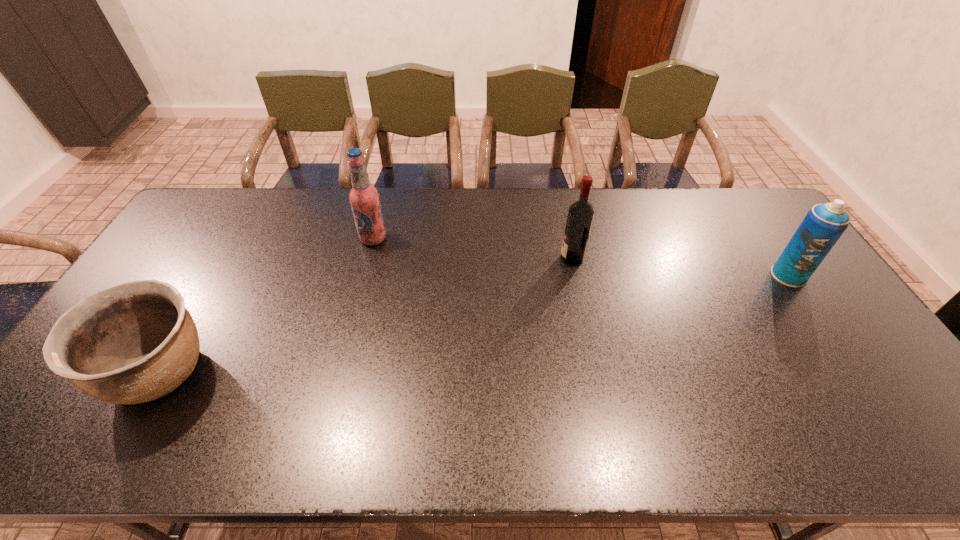
Image resolution: width=960 pixels, height=540 pixels. What are the coordinates of `the second object from left to right` in the screenshot? It's located at (364, 198).

At what (x,y) coordinates should I click in order to perform the action: click on the left alcohol. Please return your answer as a coordinate pair (x, y). Looking at the image, I should click on (364, 198).

In order to click on the nearer alcohol in this screenshot , I will do `click(580, 215)`.

You are a GUI agent. You are given a task and a screenshot of the screen. Output one action in this format:
    pyautogui.click(x=<x>, y=<y>)
    Task: Click on the third object from left to right
    Image resolution: width=960 pixels, height=540 pixels.
    Given the screenshot: What is the action you would take?
    pyautogui.click(x=580, y=215)

Where is `the rightmost object`? the rightmost object is located at coordinates (823, 225).

I want to click on the nearest object, so click(x=135, y=342).

The height and width of the screenshot is (540, 960). Find the location of `the leftmost object`. the leftmost object is located at coordinates (135, 342).

Locate an element on the screen. vacant area located on the left of the third object from right to left is located at coordinates (315, 239).

You are a GUI agent. You are given a task and a screenshot of the screen. Output one action in this format:
    pyautogui.click(x=<x>, y=<y>)
    Task: Click on the free spot located on the front and back of the nearer alcohol
    Image resolution: width=960 pixels, height=540 pixels.
    Given the screenshot: What is the action you would take?
    pyautogui.click(x=489, y=259)

Locate an element on the screen. Image resolution: width=960 pixels, height=540 pixels. blank space located 0.360m on the front and back of the nearer alcohol is located at coordinates (447, 259).